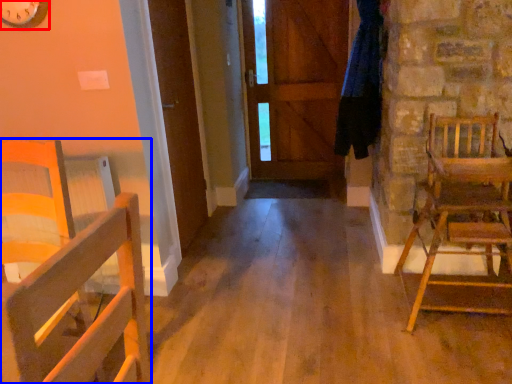
Question: Which object is closer to the camera taking this photo, clock (highlighted by a red box) or chair (highlighted by a blue box)?

Choices:
 (A) clock
 (B) chair

Answer: (A)